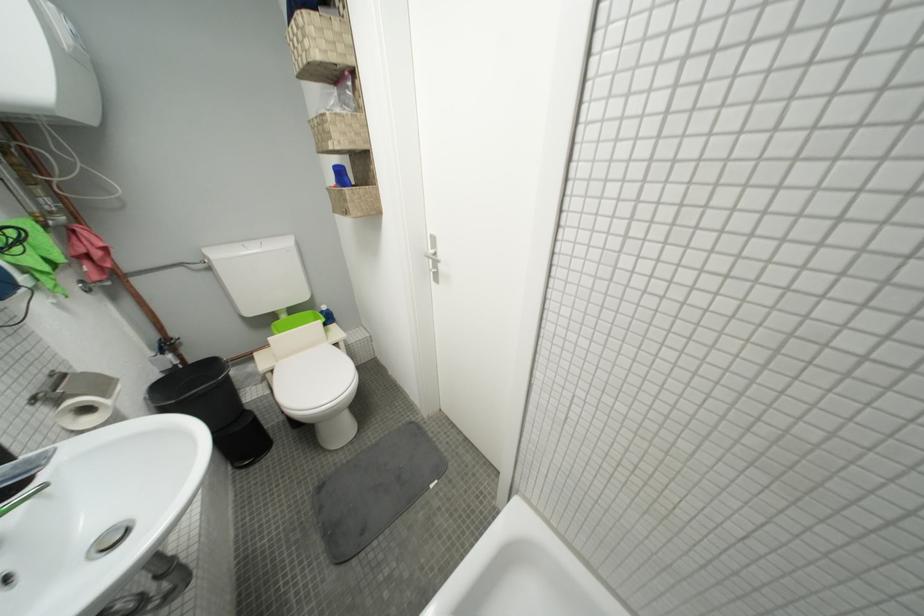
Where would you lift the black trash can lid? Please return your answer as a coordinate pair (x, y).

(195, 387)